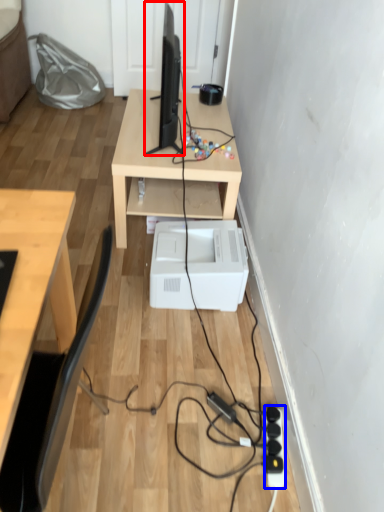
Question: Which object appears closest to the camera in this image, desktop computer (highlighted by a red box) or extension cord (highlighted by a blue box)?

Choices:
 (A) desktop computer
 (B) extension cord

Answer: (B)